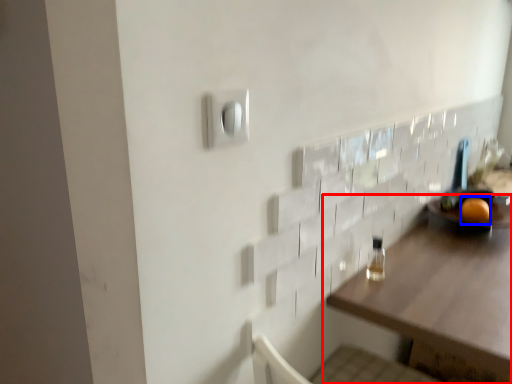
Question: Which object is closer to the camera taking this photo, table (highlighted by a red box) or orange (highlighted by a blue box)?

Choices:
 (A) table
 (B) orange

Answer: (A)